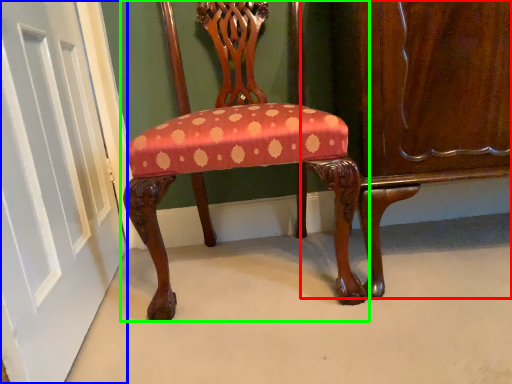
Question: Which object is the farthest from dresser (highlighted by a red box)? Choose among these: door (highlighted by a blue box) or chair (highlighted by a green box).

Choices:
 (A) door
 (B) chair

Answer: (A)